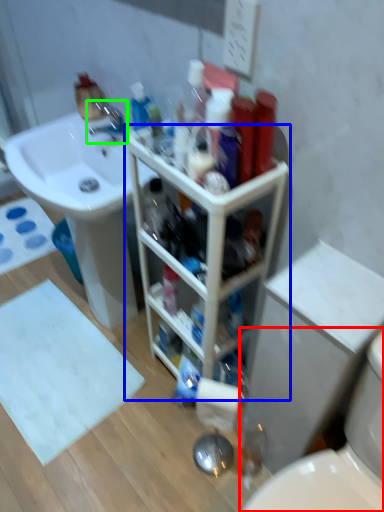
Question: Which is nearer to the toilet (highlighted by a red box)? bathroom cabinet (highlighted by a blue box) or tap (highlighted by a green box).

Choices:
 (A) bathroom cabinet
 (B) tap

Answer: (A)